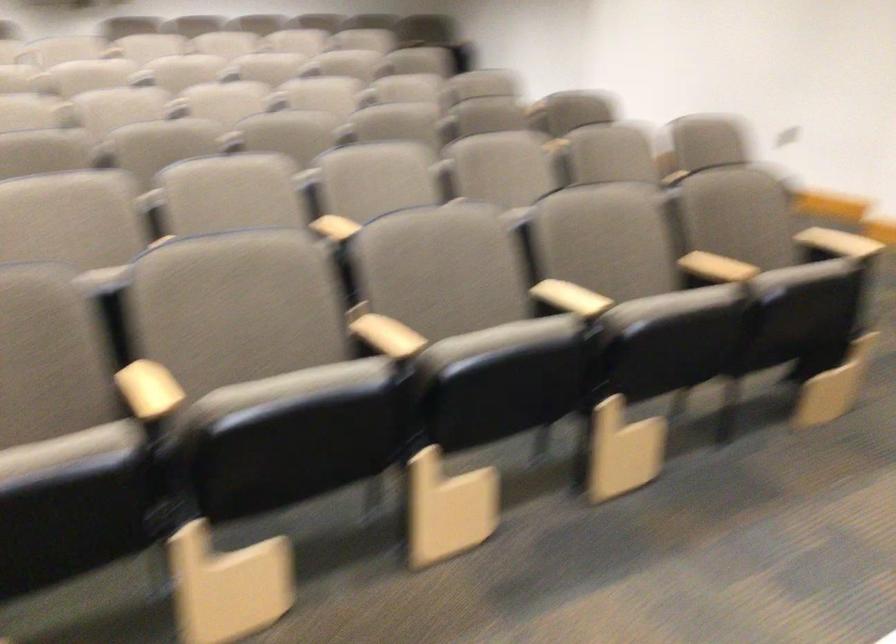
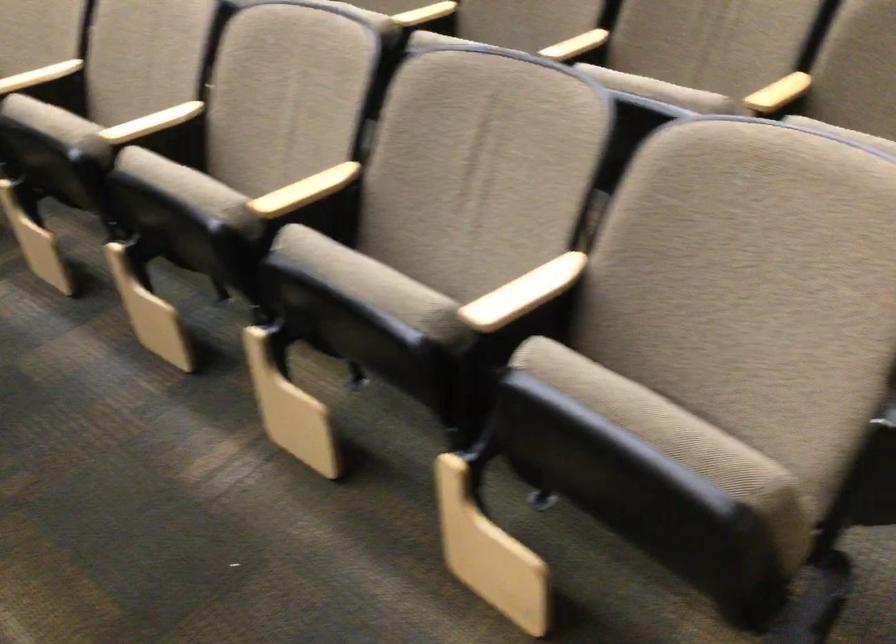
Locate, in the second image, the point that corresponds to the point at 366,202 in the first image.

(39, 76)